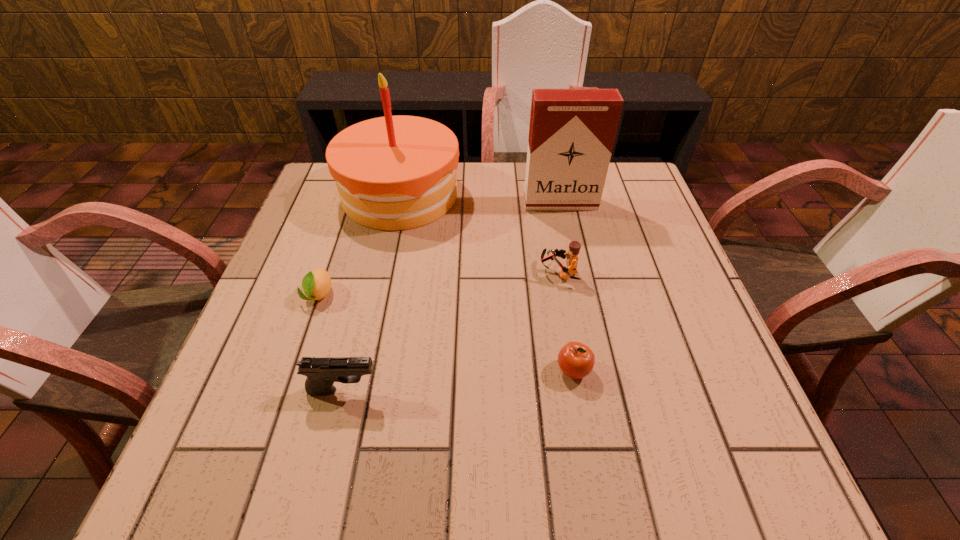
Locate an element on the screen. vacant area that satisfies the following two spatial constraints: 1. holding a crossbow in the hands of the Lego; 2. with leaves positioned above the lemon is located at coordinates (563, 295).

The height and width of the screenshot is (540, 960). I want to click on vacant area that satisfies the following two spatial constraints: 1. holding a crossbow in the hands of the Lego; 2. on the front side of the apple, so click(x=575, y=370).

You are a GUI agent. You are given a task and a screenshot of the screen. Output one action in this format:
    pyautogui.click(x=<x>, y=<y>)
    Task: Click on the free location that satisfies the following two spatial constraints: 1. on the front-facing side of the cigarette_case; 2. at the barrel of the pistol
    This screenshot has height=540, width=960.
    Given the screenshot: What is the action you would take?
    pyautogui.click(x=599, y=390)